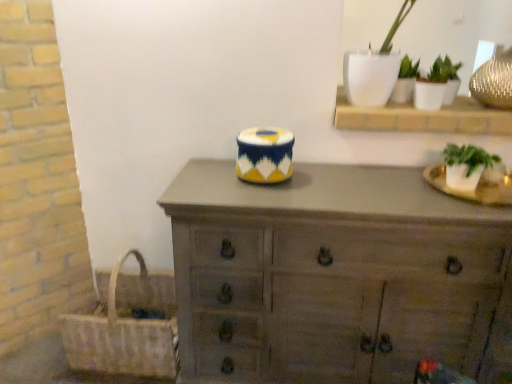
What is the approximate height of white ceramic pot at upper right, the second houseplant positioned from the bottom?

It is 18.44 centimeters.

Identify the location of white ceramic pot at upper right, which is the 2th houseplant in top-to-bottom order. (435, 84).

In order to face wooden shelf at upper right, should I rotate leftwards or rightwards?

You should rotate right by 22.793 degrees.

I want to click on green leafy plant in clear pot at right, the 3th houseplant from the top, so click(466, 165).

Where is `white glossy pot at upper right, acting as the first houseplant starting from the top`? The height and width of the screenshot is (384, 512). white glossy pot at upper right, acting as the first houseplant starting from the top is located at coordinates (405, 81).

I want to click on white ceramic pot at upper right, which is the 2th houseplant in top-to-bottom order, so click(435, 84).

Could you tell me if white ceramic pot at upper right, the second houseplant positioned from the bottom, is facing white glossy pot at upper right, acting as the first houseplant starting from the top?

No, white ceramic pot at upper right, the second houseplant positioned from the bottom, is not oriented towards white glossy pot at upper right, acting as the first houseplant starting from the top.

Based on their positions, is white ceramic pot at upper right, the second houseplant positioned from the bottom, located to the left or right of white glossy pot at upper right, the 3th houseplant from the bottom?

white ceramic pot at upper right, the second houseplant positioned from the bottom, is to the right of white glossy pot at upper right, the 3th houseplant from the bottom.

Could you measure the distance between white ceramic pot at upper right, the second houseplant positioned from the bottom, and white glossy pot at upper right, the 3th houseplant from the bottom?

3.86 inches.

From a real-world perspective, is white ceramic pot at upper right, the second houseplant positioned from the bottom, under white glossy pot at upper right, acting as the first houseplant starting from the top?

Correct, in the physical world, white ceramic pot at upper right, the second houseplant positioned from the bottom, is lower than white glossy pot at upper right, acting as the first houseplant starting from the top.

Considering the relative sizes of woven straw picnic basket at lower left and white ceramic pot at upper right, which is the 2th houseplant in top-to-bottom order, in the image provided, is woven straw picnic basket at lower left shorter than white ceramic pot at upper right, which is the 2th houseplant in top-to-bottom order,?

In fact, woven straw picnic basket at lower left may be taller than white ceramic pot at upper right, which is the 2th houseplant in top-to-bottom order.

Is woven straw picnic basket at lower left far away from white ceramic pot at upper right, the second houseplant positioned from the bottom?

That's right, there is a large distance between woven straw picnic basket at lower left and white ceramic pot at upper right, the second houseplant positioned from the bottom.

Is woven straw picnic basket at lower left behind white ceramic pot at upper right, which is the 2th houseplant in top-to-bottom order?

Yes, the depth of woven straw picnic basket at lower left is greater than that of white ceramic pot at upper right, which is the 2th houseplant in top-to-bottom order.

Locate an element on the screen. picnic basket behind the white ceramic pot at upper right, which is the 2th houseplant in top-to-bottom order is located at coordinates (126, 326).

Is green leafy plant in clear pot at right, the 3th houseplant from the top, positioned far away from white glossy pot at upper right, acting as the first houseplant starting from the top?

green leafy plant in clear pot at right, the 3th houseplant from the top, is actually quite close to white glossy pot at upper right, acting as the first houseplant starting from the top.

Which object is closer to the camera taking this photo, green leafy plant in clear pot at right, the 3th houseplant from the top, or white glossy pot at upper right, acting as the first houseplant starting from the top?

green leafy plant in clear pot at right, the 3th houseplant from the top, is closer to the camera.

Would you say green leafy plant in clear pot at right, the 3th houseplant from the top, is to the left or to the right of white glossy pot at upper right, the 3th houseplant from the bottom, in the picture?

green leafy plant in clear pot at right, the 3th houseplant from the top, is to the right of white glossy pot at upper right, the 3th houseplant from the bottom.

Is green leafy plant in clear pot at right, the 3th houseplant from the top, outside of wooden chest of drawers at center?

Indeed, green leafy plant in clear pot at right, the 3th houseplant from the top, is completely outside wooden chest of drawers at center.

From a real-world perspective, which object stands above the other?

green leafy plant in clear pot at right, the 1th houseplant from the bottom, is physically above.

Consider the image. Is green leafy plant in clear pot at right, the 1th houseplant from the bottom, to the right of wooden chest of drawers at center from the viewer's perspective?

Correct, you'll find green leafy plant in clear pot at right, the 1th houseplant from the bottom, to the right of wooden chest of drawers at center.

Considering the relative sizes of green leafy plant in clear pot at right, the 3th houseplant from the top, and wooden chest of drawers at center in the image provided, is green leafy plant in clear pot at right, the 3th houseplant from the top, smaller than wooden chest of drawers at center?

Yes.

Based on the photo, can you tell me how much wooden chest of drawers at center and white glossy pot at upper right, acting as the first houseplant starting from the top, differ in facing direction?

wooden chest of drawers at center and white glossy pot at upper right, acting as the first houseplant starting from the top, are facing 0.269 degrees away from each other.

Is wooden chest of drawers at center beside white glossy pot at upper right, acting as the first houseplant starting from the top?

wooden chest of drawers at center is not next to white glossy pot at upper right, acting as the first houseplant starting from the top, and they're not touching.

Considering the relative sizes of wooden chest of drawers at center and white glossy pot at upper right, the 3th houseplant from the bottom, in the image provided, is wooden chest of drawers at center smaller than white glossy pot at upper right, the 3th houseplant from the bottom,?

Incorrect, wooden chest of drawers at center is not smaller in size than white glossy pot at upper right, the 3th houseplant from the bottom.

Between wooden chest of drawers at center and white glossy pot at upper right, the 3th houseplant from the bottom, which one is positioned in front?

Positioned in front is wooden chest of drawers at center.

Based on their sizes in the image, would you say green leafy plant in clear pot at right, the 1th houseplant from the bottom, is bigger or smaller than woven straw picnic basket at lower left?

green leafy plant in clear pot at right, the 1th houseplant from the bottom, is smaller than woven straw picnic basket at lower left.

Is green leafy plant in clear pot at right, the 1th houseplant from the bottom, wider or thinner than woven straw picnic basket at lower left?

Clearly, green leafy plant in clear pot at right, the 1th houseplant from the bottom, has less width compared to woven straw picnic basket at lower left.

Considering the relative positions of green leafy plant in clear pot at right, the 3th houseplant from the top, and woven straw picnic basket at lower left in the image provided, is green leafy plant in clear pot at right, the 3th houseplant from the top, behind woven straw picnic basket at lower left?

No, green leafy plant in clear pot at right, the 3th houseplant from the top, is closer to the camera.

The width and height of the screenshot is (512, 384). In order to click on picnic basket that appears below the green leafy plant in clear pot at right, the 1th houseplant from the bottom (from a real-world perspective) in this screenshot , I will do `click(126, 326)`.

Which object is wider, white glossy pot at upper right, acting as the first houseplant starting from the top, or white ceramic pot at upper right, the second houseplant positioned from the bottom?

white glossy pot at upper right, acting as the first houseplant starting from the top, is wider.

Would you consider white glossy pot at upper right, the 3th houseplant from the bottom, to be distant from white ceramic pot at upper right, the second houseplant positioned from the bottom?

white glossy pot at upper right, the 3th houseplant from the bottom, is actually quite close to white ceramic pot at upper right, the second houseplant positioned from the bottom.

Is white glossy pot at upper right, acting as the first houseplant starting from the top, positioned with its back to white ceramic pot at upper right, which is the 2th houseplant in top-to-bottom order?

No, white ceramic pot at upper right, which is the 2th houseplant in top-to-bottom order, is not at the back of white glossy pot at upper right, acting as the first houseplant starting from the top.

Is white ceramic pot at upper right, which is the 2th houseplant in top-to-bottom order, completely or partially inside white glossy pot at upper right, the 3th houseplant from the bottom?

Definitely not — white ceramic pot at upper right, which is the 2th houseplant in top-to-bottom order, is not inside white glossy pot at upper right, the 3th houseplant from the bottom.

You are a GUI agent. You are given a task and a screenshot of the screen. Output one action in this format:
    pyautogui.click(x=<x>, y=<y>)
    Task: Click on the houseplant behind the white ceramic pot at upper right, which is the 2th houseplant in top-to-bottom order
    
    Given the screenshot: What is the action you would take?
    pyautogui.click(x=405, y=81)

The width and height of the screenshot is (512, 384). I want to click on picnic basket below the white ceramic pot at upper right, which is the 2th houseplant in top-to-bottom order (from the image's perspective), so click(126, 326).

Looking at the image, which one is located closer to white ceramic pot at upper right, which is the 2th houseplant in top-to-bottom order, green leafy plant in clear pot at right, the 1th houseplant from the bottom, or woven straw picnic basket at lower left?

green leafy plant in clear pot at right, the 1th houseplant from the bottom, lies closer to white ceramic pot at upper right, which is the 2th houseplant in top-to-bottom order, than the other object.

Looking at the image, which one is located closer to white glossy pot at upper right, acting as the first houseplant starting from the top, woven straw picnic basket at lower left or wooden chest of drawers at center?

wooden chest of drawers at center lies closer to white glossy pot at upper right, acting as the first houseplant starting from the top, than the other object.

Based on their spatial positions, is white ceramic pot at upper right, which is the 2th houseplant in top-to-bottom order, or woven straw picnic basket at lower left closer to green leafy plant in clear pot at right, the 3th houseplant from the top?

white ceramic pot at upper right, which is the 2th houseplant in top-to-bottom order.

Considering their positions, is wooden chest of drawers at center positioned further to woven straw picnic basket at lower left than white glossy pot at upper right, acting as the first houseplant starting from the top?

Based on the image, white glossy pot at upper right, acting as the first houseplant starting from the top, appears to be further to woven straw picnic basket at lower left.

Which object lies nearer to the anchor point green leafy plant in clear pot at right, the 3th houseplant from the top, wooden chest of drawers at center or wooden shelf at upper right?

Based on the image, wooden shelf at upper right appears to be nearer to green leafy plant in clear pot at right, the 3th houseplant from the top.

When comparing their distances from green leafy plant in clear pot at right, the 3th houseplant from the top, does wooden shelf at upper right or white ceramic pot at upper right, which is the 2th houseplant in top-to-bottom order, seem further?

white ceramic pot at upper right, which is the 2th houseplant in top-to-bottom order, lies further to green leafy plant in clear pot at right, the 3th houseplant from the top, than the other object.

Considering their positions, is white ceramic pot at upper right, the second houseplant positioned from the bottom, positioned closer to wooden shelf at upper right than green leafy plant in clear pot at right, the 3th houseplant from the top?

white ceramic pot at upper right, the second houseplant positioned from the bottom.

Which object lies nearer to the anchor point white ceramic pot at upper right, the second houseplant positioned from the bottom, green leafy plant in clear pot at right, the 3th houseplant from the top, or wooden shelf at upper right?

Based on the image, wooden shelf at upper right appears to be nearer to white ceramic pot at upper right, the second houseplant positioned from the bottom.

The height and width of the screenshot is (384, 512). What are the coordinates of `the chest of drawers located between woven straw picnic basket at lower left and wooden shelf at upper right in the left-right direction` in the screenshot? It's located at (335, 277).

I want to click on the chest of drawers situated between woven straw picnic basket at lower left and green leafy plant in clear pot at right, the 1th houseplant from the bottom, from left to right, so click(x=335, y=277).

Where is `houseplant that lies between white ceramic pot at upper right, the second houseplant positioned from the bottom, and wooden chest of drawers at center from top to bottom`? houseplant that lies between white ceramic pot at upper right, the second houseplant positioned from the bottom, and wooden chest of drawers at center from top to bottom is located at coordinates [x=466, y=165].

Find the location of `shelf between woven straw picnic basket at lower left and green leafy plant in clear pot at right, the 3th houseplant from the top, from left to right`. shelf between woven straw picnic basket at lower left and green leafy plant in clear pot at right, the 3th houseplant from the top, from left to right is located at coordinates (423, 117).